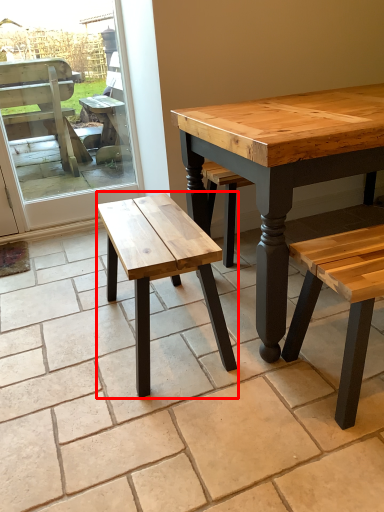
Question: From the image's perspective, where is stool (annotated by the red box) located relative to screen door?

Choices:
 (A) below
 (B) above

Answer: (A)